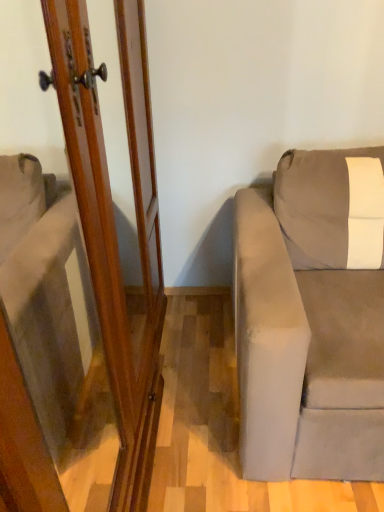
Question: Is gray suede couch at right inside the boundaries of wooden screen door at left, or outside?

Choices:
 (A) outside
 (B) inside

Answer: (A)

Question: From a real-world perspective, is gray suede couch at right physically located above or below wooden screen door at left?

Choices:
 (A) above
 (B) below

Answer: (B)

Question: Relative to wooden screen door at left, is gray suede couch at right in front or behind?

Choices:
 (A) behind
 (B) front

Answer: (A)

Question: Relative to gray suede couch at right, is wooden screen door at left in front or behind?

Choices:
 (A) front
 (B) behind

Answer: (A)

Question: Would you say wooden screen door at left is inside or outside gray suede couch at right?

Choices:
 (A) inside
 (B) outside

Answer: (B)

Question: Considering the positions of wooden screen door at left and gray suede couch at right in the image, is wooden screen door at left taller or shorter than gray suede couch at right?

Choices:
 (A) tall
 (B) short

Answer: (A)

Question: In the image, is wooden screen door at left on the left side or the right side of gray suede couch at right?

Choices:
 (A) left
 (B) right

Answer: (A)